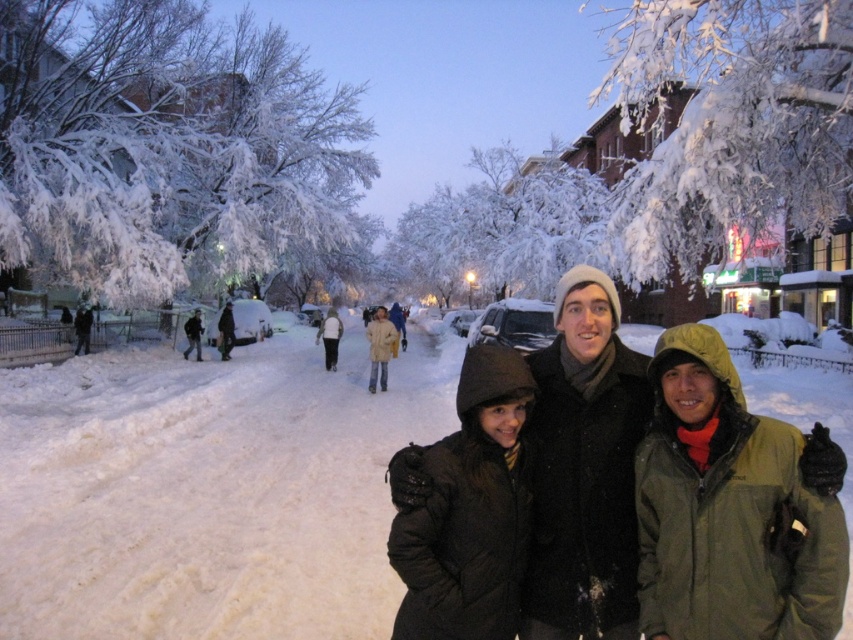
Which is above, light brown fur coat at center or dark gray wool coat at center?

light brown fur coat at center is above.

Find the location of `light brown fur coat at center`. light brown fur coat at center is located at coordinates (380, 348).

Image resolution: width=853 pixels, height=640 pixels. In order to click on light brown fur coat at center in this screenshot , I will do coord(380,348).

Is black quilted jacket at center shorter than light brown fur coat at center?

Indeed, black quilted jacket at center has a lesser height compared to light brown fur coat at center.

Does point (432, 598) lie behind point (381, 385)?

No, (432, 598) is closer to viewer.

Image resolution: width=853 pixels, height=640 pixels. Identify the location of black quilted jacket at center. (465, 509).

At what (x,y) coordinates should I click in order to perform the action: click on black quilted jacket at center. Please return your answer as a coordinate pair (x, y). This screenshot has height=640, width=853. Looking at the image, I should click on (465, 509).

Does matte black coat at center have a lesser width compared to black quilted jacket at center?

No.

This screenshot has height=640, width=853. What are the coordinates of `matte black coat at center` in the screenshot? It's located at (584, 468).

You are a GUI agent. You are given a task and a screenshot of the screen. Output one action in this format:
    pyautogui.click(x=<x>, y=<y>)
    Task: Click on the matte black coat at center
    Image resolution: width=853 pixels, height=640 pixels.
    Given the screenshot: What is the action you would take?
    pyautogui.click(x=584, y=468)